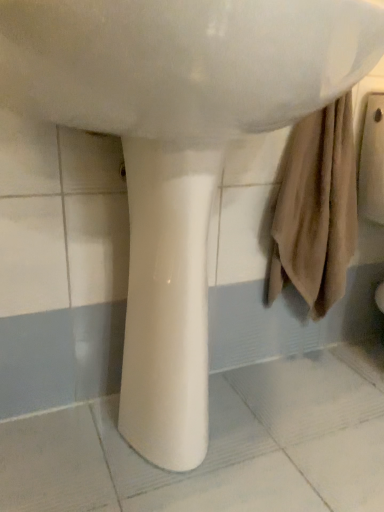
Describe the element at coordinates (167, 303) in the screenshot. This screenshot has height=512, width=384. I see `white glossy pedestal at center` at that location.

This screenshot has width=384, height=512. Identify the location of white glossy pedestal at center. (167, 303).

The height and width of the screenshot is (512, 384). What do you see at coordinates (183, 62) in the screenshot?
I see `white glossy sink at center` at bounding box center [183, 62].

Where is `white glossy sink at center`? This screenshot has height=512, width=384. white glossy sink at center is located at coordinates (183, 62).

Identify the location of white glossy pedestal at center. This screenshot has height=512, width=384. (167, 303).

Consider the image. Would you say white glossy sink at center is to the left or to the right of white glossy pedestal at center in the picture?

white glossy sink at center is positioned on white glossy pedestal at center's right side.

Considering the relative positions of white glossy sink at center and white glossy pedestal at center in the image provided, is white glossy sink at center in front of white glossy pedestal at center?

Yes, it is in front of white glossy pedestal at center.

Which point is more distant from viewer, (195, 4) or (204, 437)?

Point (204, 437)

From the image's perspective, is white glossy sink at center located above or below white glossy pedestal at center?

Clearly, from the image's perspective, white glossy sink at center is above white glossy pedestal at center.

From a real-world perspective, is white glossy sink at center physically above white glossy pedestal at center?

Yes, from a real-world perspective, white glossy sink at center is above white glossy pedestal at center.

Considering the sizes of white glossy sink at center and white glossy pedestal at center in the image, is white glossy sink at center wider or thinner than white glossy pedestal at center?

white glossy sink at center is wider than white glossy pedestal at center.

In the scene shown: In terms of height, does white glossy sink at center look taller or shorter compared to white glossy pedestal at center?

In the image, white glossy sink at center appears to be shorter than white glossy pedestal at center.

From the picture: Between white glossy sink at center and white glossy pedestal at center, which one has larger size?

white glossy sink at center.

Could white glossy pedestal at center be considered to be inside white glossy sink at center?

No, white glossy pedestal at center is not inside white glossy sink at center.

Are white glossy sink at center and white glossy pedestal at center making contact?

No, white glossy sink at center is not beside white glossy pedestal at center.

Could you tell me if white glossy sink at center is turned towards white glossy pedestal at center?

No, white glossy sink at center does not turn towards white glossy pedestal at center.

Based on the photo, how different are the orientations of white glossy sink at center and white glossy pedestal at center in degrees?

0.359 degrees.

How distant is white glossy sink at center from white glossy pedestal at center?

white glossy sink at center is 9.51 inches away from white glossy pedestal at center.

In the image, there is a white glossy pedestal at center. Where is `sink above it (from the image's perspective)`? Image resolution: width=384 pixels, height=512 pixels. sink above it (from the image's perspective) is located at coordinates (183, 62).

Can you confirm if white glossy pedestal at center is positioned to the right of white glossy sink at center?

In fact, white glossy pedestal at center is to the left of white glossy sink at center.

Relative to white glossy sink at center, is white glossy pedestal at center in front or behind?

Clearly, white glossy pedestal at center is behind white glossy sink at center.

Is point (198, 269) less distant than point (352, 48)?

No, it is not.

From the image's perspective, is white glossy pedestal at center above white glossy sink at center?

No, from the image's perspective, white glossy pedestal at center is not on top of white glossy sink at center.

Looking at this image, from a real-world perspective, who is located lower, white glossy pedestal at center or white glossy sink at center?

white glossy pedestal at center is physically lower.

Considering the sizes of objects white glossy pedestal at center and white glossy sink at center in the image provided, who is wider, white glossy pedestal at center or white glossy sink at center?

white glossy sink at center.

Considering the relative sizes of white glossy pedestal at center and white glossy sink at center in the image provided, is white glossy pedestal at center taller than white glossy sink at center?

Indeed, white glossy pedestal at center has a greater height compared to white glossy sink at center.

Which of these two, white glossy pedestal at center or white glossy sink at center, is smaller?

white glossy pedestal at center is smaller.

Is white glossy sink at center a part of white glossy pedestal at center?

No, white glossy sink at center is not surrounded by white glossy pedestal at center.

Is white glossy pedestal at center beside white glossy sink at center?

No.

Consider the image. Is white glossy pedestal at center positioned with its back to white glossy sink at center?

No.

How many degrees apart are the facing directions of white glossy pedestal at center and white glossy sink at center?

There is a 0.359-degree angle between the facing directions of white glossy pedestal at center and white glossy sink at center.

I want to click on sink above the white glossy pedestal at center (from a real-world perspective), so click(x=183, y=62).

You are a GUI agent. You are given a task and a screenshot of the screen. Output one action in this format:
    pyautogui.click(x=<x>, y=<y>)
    Task: Click on the pillar below the white glossy sink at center (from the image's perspective)
    
    Given the screenshot: What is the action you would take?
    pyautogui.click(x=167, y=303)

Where is `pillar below the white glossy sink at center (from a real-world perspective)`? pillar below the white glossy sink at center (from a real-world perspective) is located at coordinates (167, 303).